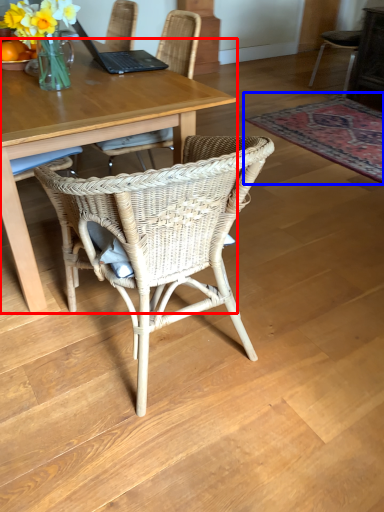
Question: Which object is closer to the camera taking this photo, desk (highlighted by a red box) or mat (highlighted by a blue box)?

Choices:
 (A) desk
 (B) mat

Answer: (A)